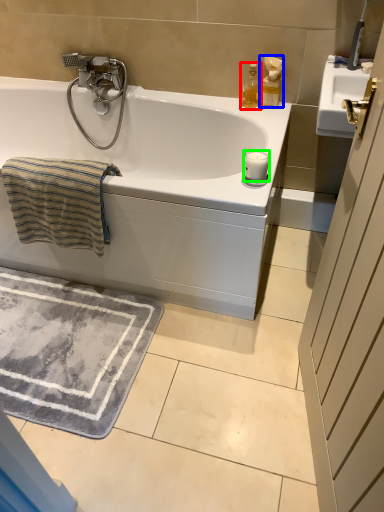
Question: Considering the real-world distances, which object is farthest from soap dispenser (highlighted by a red box)? soap dispenser (highlighted by a blue box) or candle (highlighted by a green box)?

Choices:
 (A) soap dispenser
 (B) candle

Answer: (B)